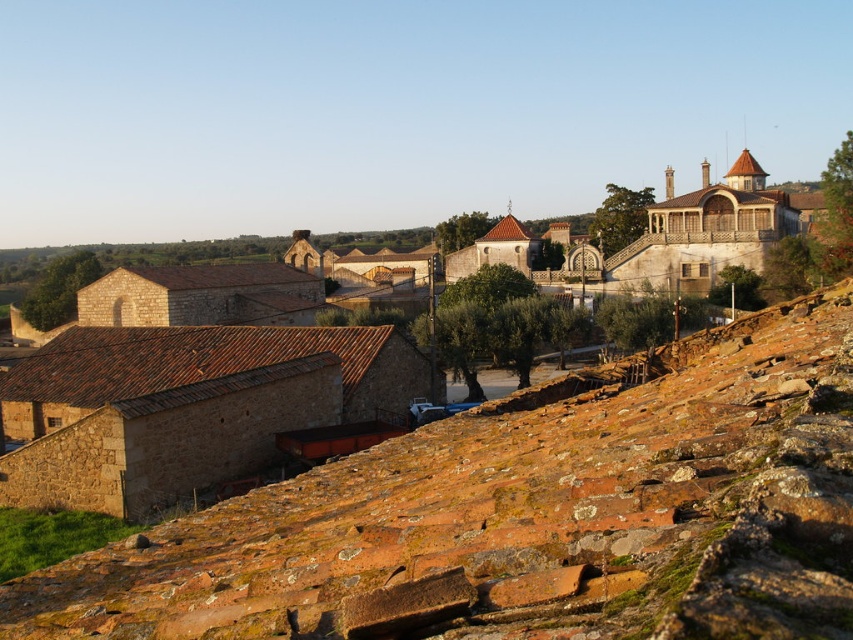
Is brown stone hillside at lower right closer to the viewer compared to brown stone village at center?

Yes, it is in front of brown stone village at center.

Which of these two, brown stone hillside at lower right or brown stone village at center, stands taller?

brown stone village at center

Where is `brown stone hillside at lower right`? brown stone hillside at lower right is located at coordinates (527, 515).